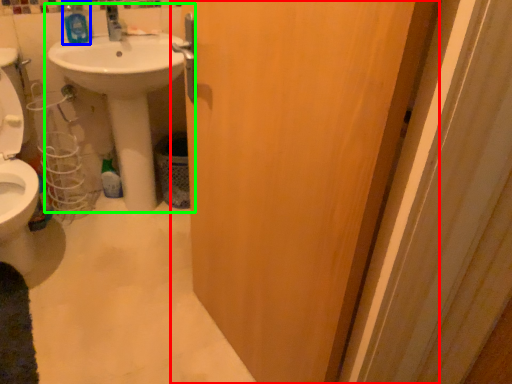
Question: Considering the real-world distances, which object is farthest from door (highlighted by a red box)? mouthwash (highlighted by a blue box) or sink (highlighted by a green box)?

Choices:
 (A) mouthwash
 (B) sink

Answer: (A)